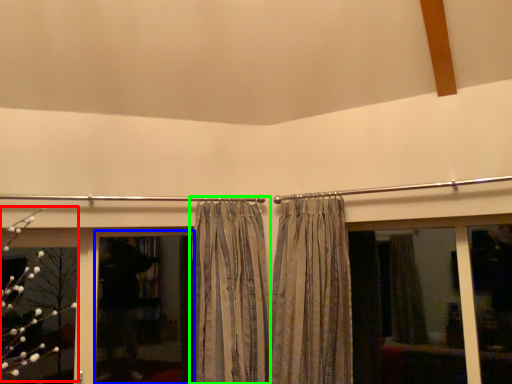
Question: Estimate the real-world distances between objects in this image. Which object is closer to flower (highlighted by a red box), screen door (highlighted by a blue box) or curtain (highlighted by a green box)?

Choices:
 (A) screen door
 (B) curtain

Answer: (A)